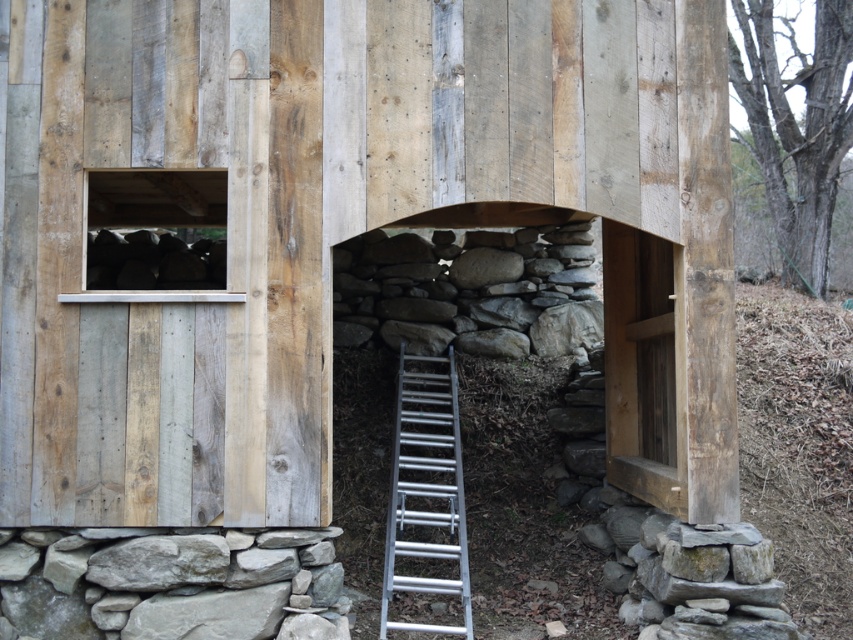
Question: Can you confirm if weathered wood barn at center is wider than silver metallic ladder at center?

Choices:
 (A) no
 (B) yes

Answer: (B)

Question: Is weathered wood barn at center thinner than silver metallic ladder at center?

Choices:
 (A) no
 (B) yes

Answer: (A)

Question: Which object is farther from the camera taking this photo?

Choices:
 (A) silver metallic ladder at center
 (B) weathered wood barn at center

Answer: (A)

Question: Which object is farther from the camera taking this photo?

Choices:
 (A) silver metallic ladder at center
 (B) weathered wood barn at center

Answer: (A)

Question: Does weathered wood barn at center appear on the left side of silver metallic ladder at center?

Choices:
 (A) yes
 (B) no

Answer: (A)